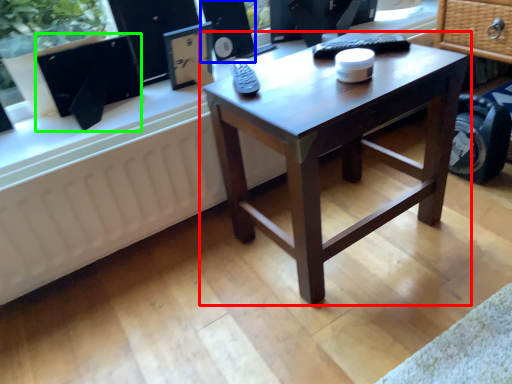
Question: Based on their relative distances, which object is farther from coffee table (highlighted by a red box)? Choose from speaker (highlighted by a blue box) and computer monitor (highlighted by a green box).

Choices:
 (A) speaker
 (B) computer monitor

Answer: (A)